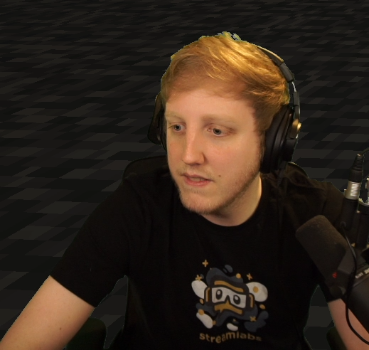
Locate an element on the screen. sound booth is located at coordinates (56, 108).